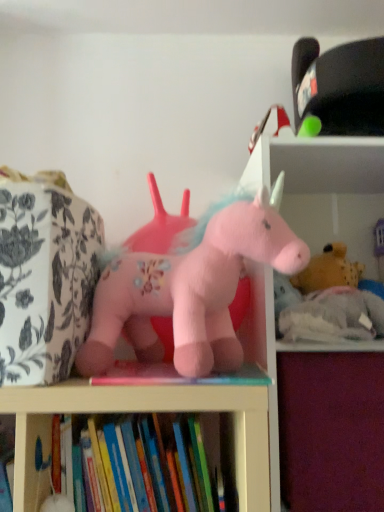
Question: Are soft white bookshelf at upper right and purple fabric drawer at lower right located far from each other?

Choices:
 (A) no
 (B) yes

Answer: (A)

Question: Is soft white bookshelf at upper right at the right side of purple fabric drawer at lower right?

Choices:
 (A) yes
 (B) no

Answer: (A)

Question: Considering the relative sizes of soft white bookshelf at upper right and purple fabric drawer at lower right in the image provided, is soft white bookshelf at upper right bigger than purple fabric drawer at lower right?

Choices:
 (A) no
 (B) yes

Answer: (B)

Question: Does soft white bookshelf at upper right have a greater width compared to purple fabric drawer at lower right?

Choices:
 (A) no
 (B) yes

Answer: (B)

Question: From a real-world perspective, is soft white bookshelf at upper right on purple fabric drawer at lower right?

Choices:
 (A) no
 (B) yes

Answer: (B)

Question: Considering the positions of soft white bookshelf at upper right and fluffy pink unicorn at center, acting as the first toy starting from the left, in the image, is soft white bookshelf at upper right wider or thinner than fluffy pink unicorn at center, acting as the first toy starting from the left,?

Choices:
 (A) thin
 (B) wide

Answer: (B)

Question: In terms of height, does soft white bookshelf at upper right look taller or shorter compared to fluffy pink unicorn at center, which is counted as the 2th toy, starting from the right?

Choices:
 (A) tall
 (B) short

Answer: (A)

Question: From the image's perspective, is soft white bookshelf at upper right positioned above or below fluffy pink unicorn at center, which is counted as the 2th toy, starting from the right?

Choices:
 (A) below
 (B) above

Answer: (A)

Question: From a real-world perspective, is soft white bookshelf at upper right above or below fluffy pink unicorn at center, which is the 1th toy from front to back?

Choices:
 (A) below
 (B) above

Answer: (A)

Question: In terms of size, does fluffy pink unicorn at center, which is the 1th toy from front to back, appear bigger or smaller than hardcover book at lower center?

Choices:
 (A) big
 (B) small

Answer: (A)

Question: Would you say fluffy pink unicorn at center, acting as the first toy starting from the left, is inside or outside hardcover book at lower center?

Choices:
 (A) inside
 (B) outside

Answer: (B)

Question: From a real-world perspective, is fluffy pink unicorn at center, which is the 2th toy from back to front, above or below hardcover book at lower center?

Choices:
 (A) below
 (B) above

Answer: (B)

Question: Is fluffy pink unicorn at center, which is the 2th toy from back to front, wider or thinner than hardcover book at lower center?

Choices:
 (A) wide
 (B) thin

Answer: (A)

Question: Would you say hardcover book at lower center is to the left or to the right of fluffy pink unicorn at center, which is the 1th toy from front to back, in the picture?

Choices:
 (A) right
 (B) left

Answer: (B)

Question: Is point (94, 458) positioned closer to the camera than point (231, 367)?

Choices:
 (A) closer
 (B) farther

Answer: (B)